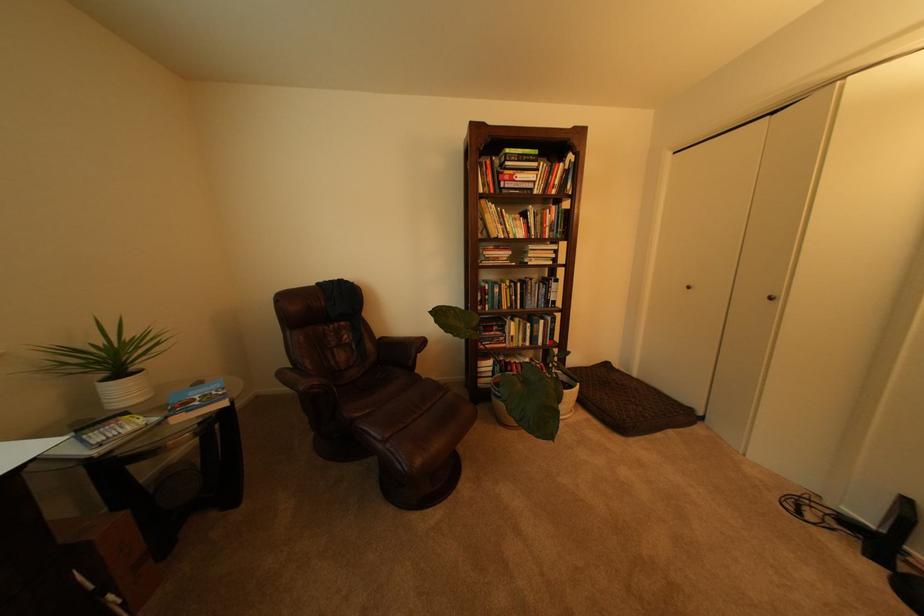
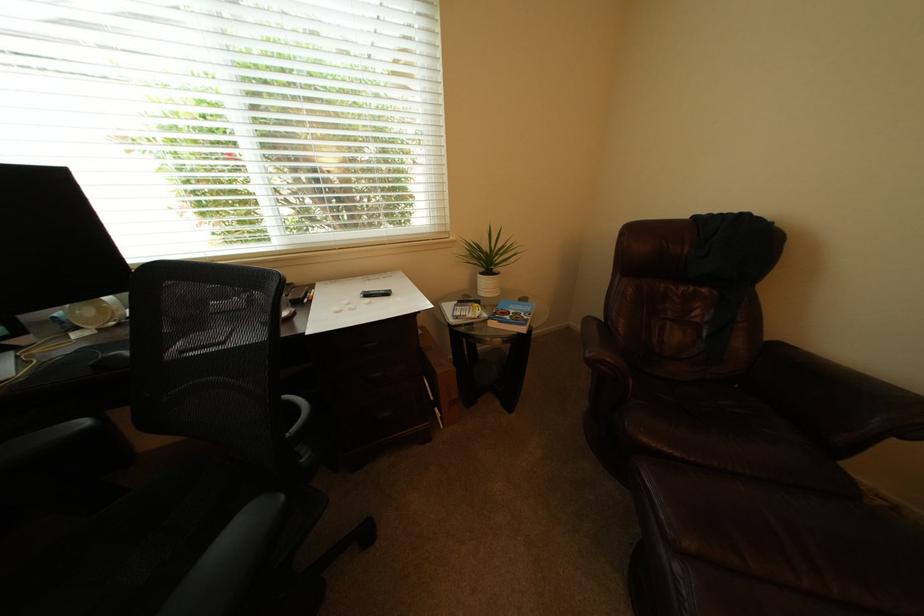
In the second image, find the point that corresponds to (x=166, y=421) in the first image.

(495, 317)